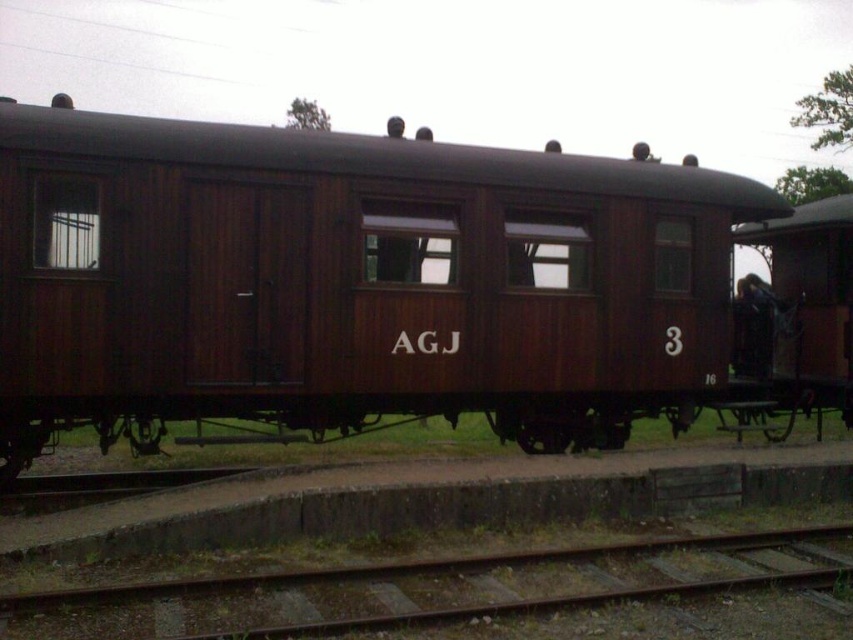
You are a railway inspector assessing the layout of the railway yard. You need to determine if the wooden train car at center can be safely placed on the rusty metal train track at lower center. Based on their widths, can the train car fit on the track?

The wooden train car at center is wider than the rusty metal train track at lower center. Therefore, the train car cannot fit safely on the track due to its greater width.

You are standing in the railway yard and see the wooden train car at center and the rusty metal train track at lower center. Which object is positioned to the right side?

The wooden train car at center is positioned to the right of the rusty metal train track at lower center.